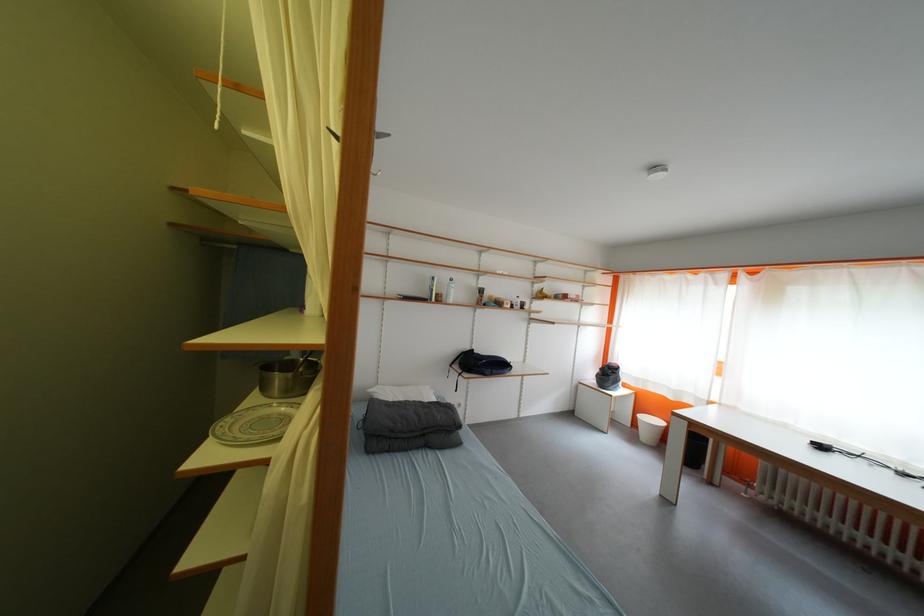
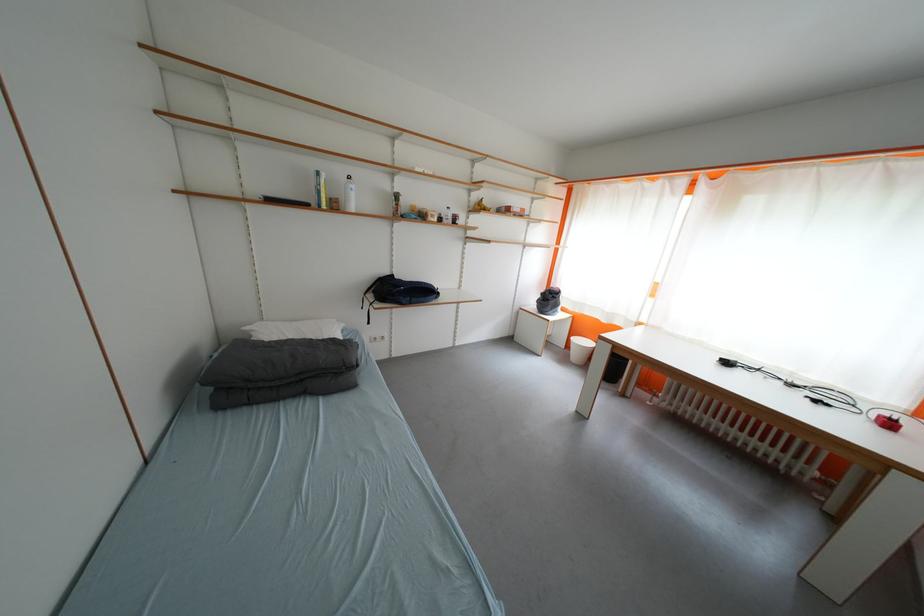
What movement of the cameraman would produce the second image?

The movement direction of the cameraman is right, forward.